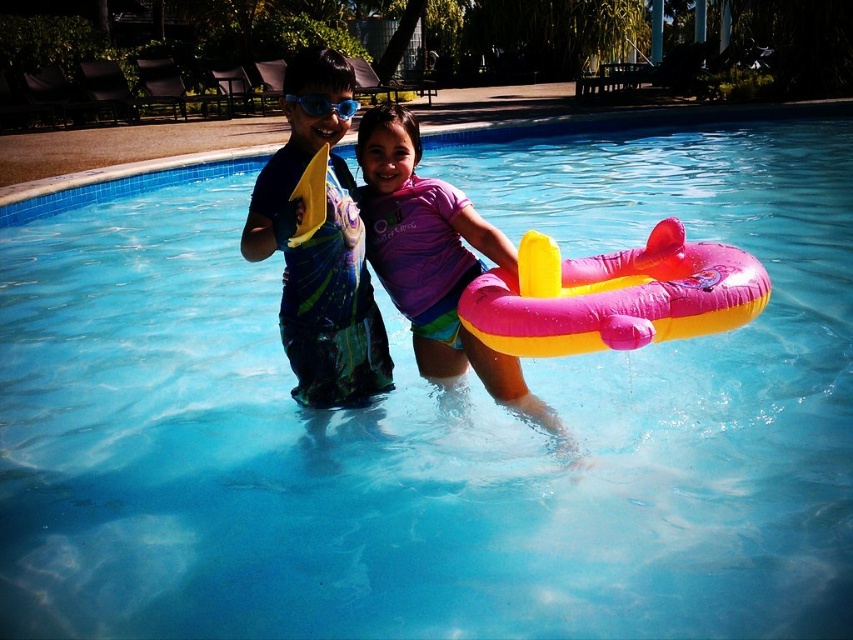
Question: Observing the image, what is the correct spatial positioning of pink rubber float at center in reference to blue matte goggles at upper center?

Choices:
 (A) right
 (B) left

Answer: (A)

Question: Which object is positioned farthest from the pink rubber ring at center?

Choices:
 (A) pink rubber float at center
 (B) blue-green swim trunks at center

Answer: (A)

Question: Is pink rubber float at center closer to the viewer compared to blue matte goggles at upper center?

Choices:
 (A) no
 (B) yes

Answer: (B)

Question: In this image, where is pink rubber float at center located relative to pink rubber ring at center?

Choices:
 (A) right
 (B) left

Answer: (A)

Question: Which point is closer to the camera taking this photo?

Choices:
 (A) (492, 278)
 (B) (320, 96)
 (C) (392, 292)

Answer: (B)

Question: Which of these objects is positioned closest to the blue-green swim trunks at center?

Choices:
 (A) blue matte goggles at upper center
 (B) pink rubber ring at center
 (C) pink rubber float at center

Answer: (B)